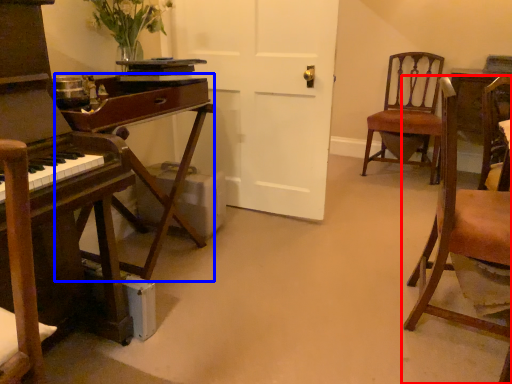
Question: Which point is closer to the camera, chair (highlighted by a red box) or table (highlighted by a blue box)?

Choices:
 (A) chair
 (B) table

Answer: (A)